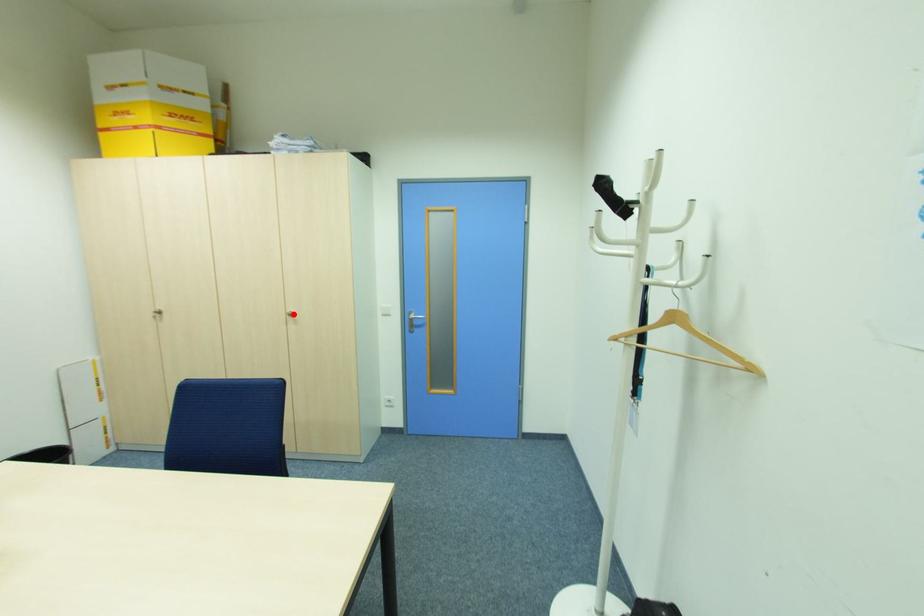
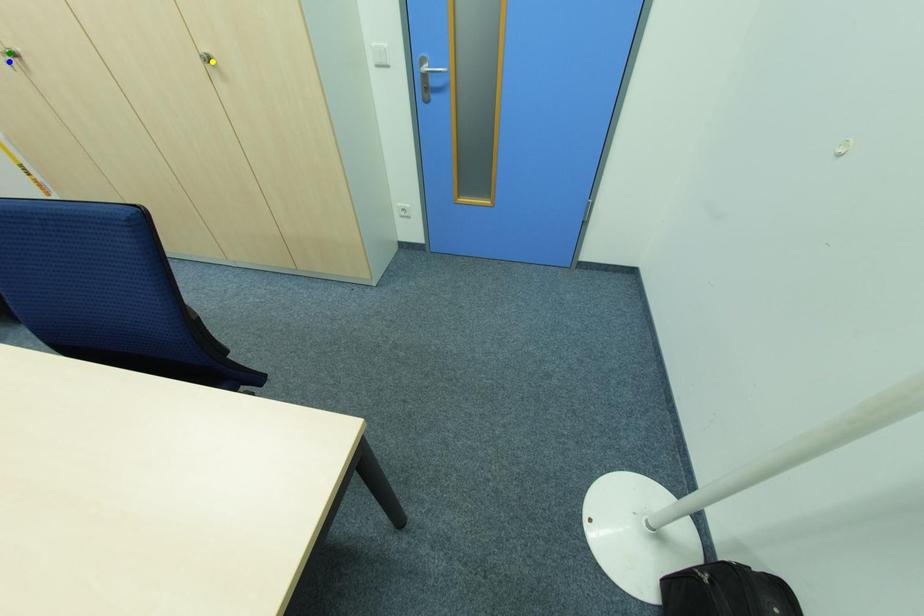
Question: I am providing you with two images of the same scene from different viewpoints. A red point is marked on the first image. You are given multiple points on the second image. Which mark in image 2 goes with the point in image 1?

Choices:
 (A) blue point
 (B) green point
 (C) yellow point

Answer: (C)